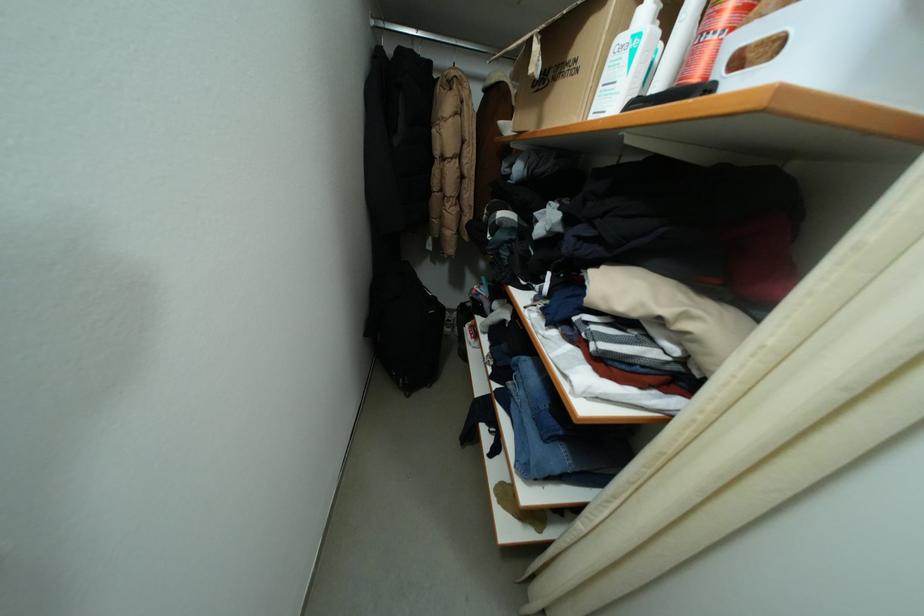
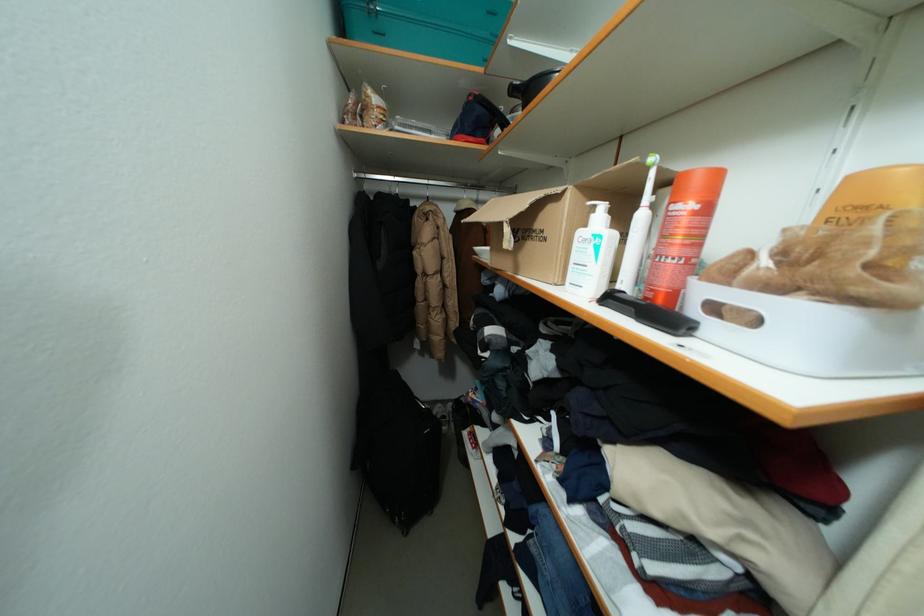
Question: The first image is from the beginning of the video and the second image is from the end. How did the camera likely rotate when shooting the video?

Choices:
 (A) Left
 (B) Right
 (C) Up
 (D) Down

Answer: (C)